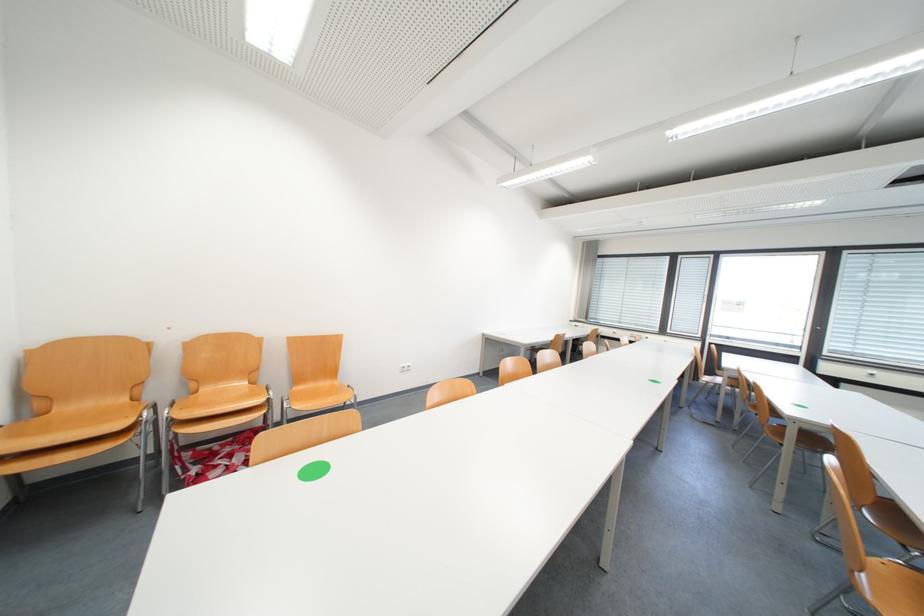
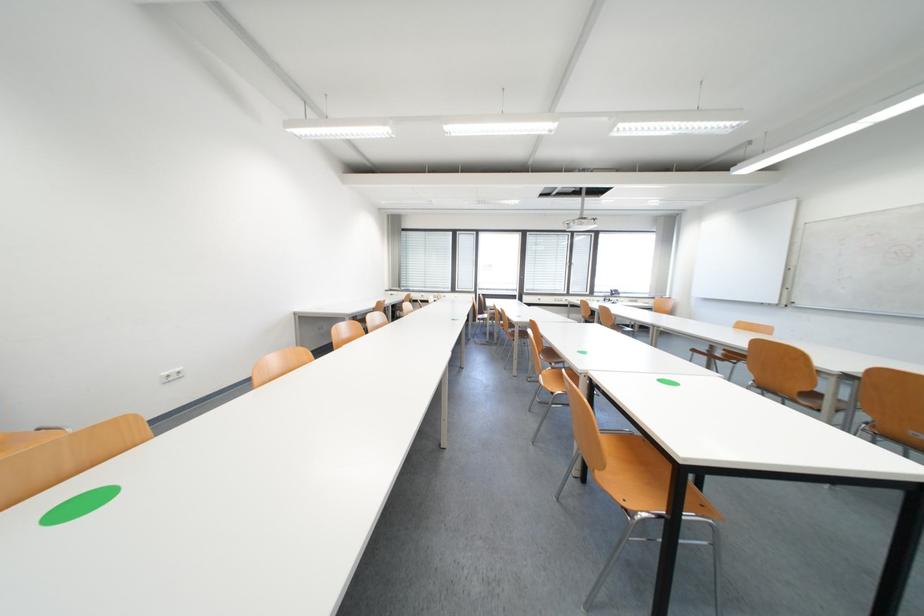
Question: The camera is either moving clockwise (left) or counter-clockwise (right) around the object. The first image is from the beginning of the video and the second image is from the end. Is the camera moving left or right when shooting the video?

Choices:
 (A) Left
 (B) Right

Answer: (A)